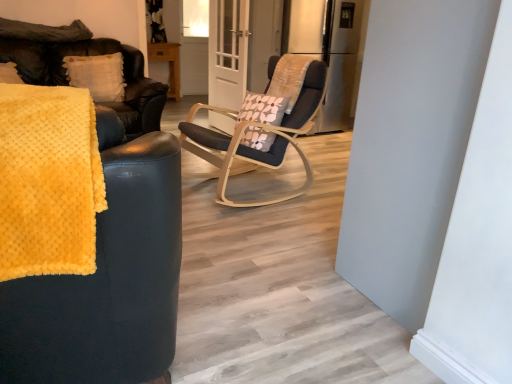
Question: Does white textured pillow at upper left have a lesser width compared to yellow fuzzy blanket at left?

Choices:
 (A) yes
 (B) no

Answer: (A)

Question: Can you confirm if white textured pillow at upper left is taller than yellow fuzzy blanket at left?

Choices:
 (A) yes
 (B) no

Answer: (B)

Question: From the image's perspective, does white textured pillow at upper left appear lower than yellow fuzzy blanket at left?

Choices:
 (A) yes
 (B) no

Answer: (B)

Question: From a real-world perspective, is white textured pillow at upper left below yellow fuzzy blanket at left?

Choices:
 (A) yes
 (B) no

Answer: (B)

Question: From a real-world perspective, is white textured pillow at upper left on top of yellow fuzzy blanket at left?

Choices:
 (A) no
 (B) yes

Answer: (B)

Question: Would you say clear glass door at center is to the left or to the right of metallic refrigerator at center in the picture?

Choices:
 (A) left
 (B) right

Answer: (A)

Question: Considering the positions of clear glass door at center and metallic refrigerator at center in the image, is clear glass door at center bigger or smaller than metallic refrigerator at center?

Choices:
 (A) big
 (B) small

Answer: (B)

Question: Is clear glass door at center wider or thinner than metallic refrigerator at center?

Choices:
 (A) wide
 (B) thin

Answer: (B)

Question: Is point (224, 105) positioned closer to the camera than point (330, 16)?

Choices:
 (A) closer
 (B) farther

Answer: (B)

Question: Does point (230, 6) appear closer or farther from the camera than point (45, 142)?

Choices:
 (A) closer
 (B) farther

Answer: (B)

Question: Is clear glass door at center spatially inside yellow fuzzy blanket at left, or outside of it?

Choices:
 (A) outside
 (B) inside

Answer: (A)

Question: From a real-world perspective, is clear glass door at center physically located above or below yellow fuzzy blanket at left?

Choices:
 (A) above
 (B) below

Answer: (B)

Question: From the image's perspective, relative to yellow fuzzy blanket at left, is clear glass door at center above or below?

Choices:
 (A) below
 (B) above

Answer: (B)

Question: In the image, is yellow fuzzy blanket at left on the left side or the right side of yellow fuzzy blanket at left?

Choices:
 (A) left
 (B) right

Answer: (A)

Question: Relative to yellow fuzzy blanket at left, is yellow fuzzy blanket at left in front or behind?

Choices:
 (A) behind
 (B) front

Answer: (B)